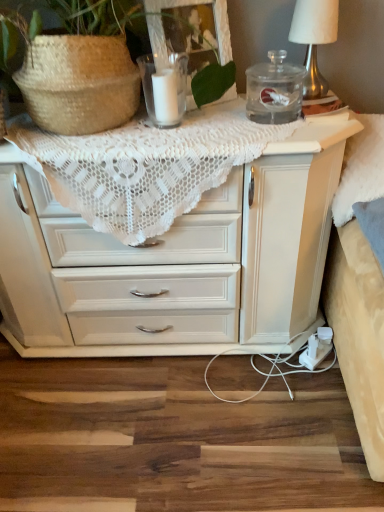
Question: In terms of height, does clear glass candle at upper center look taller or shorter compared to transparent glass jar at upper right?

Choices:
 (A) short
 (B) tall

Answer: (B)

Question: Would you say clear glass candle at upper center is to the left or to the right of transparent glass jar at upper right in the picture?

Choices:
 (A) left
 (B) right

Answer: (A)

Question: Which is farther from the transparent glass jar at upper right?

Choices:
 (A) white fabric-covered lampshade at upper right
 (B) clear glass candle at upper center
 (C) white lace doily at upper center

Answer: (C)

Question: Which object is the closest to the white lace doily at upper center?

Choices:
 (A) clear glass candle at upper center
 (B) white fabric-covered lampshade at upper right
 (C) transparent glass jar at upper right

Answer: (C)